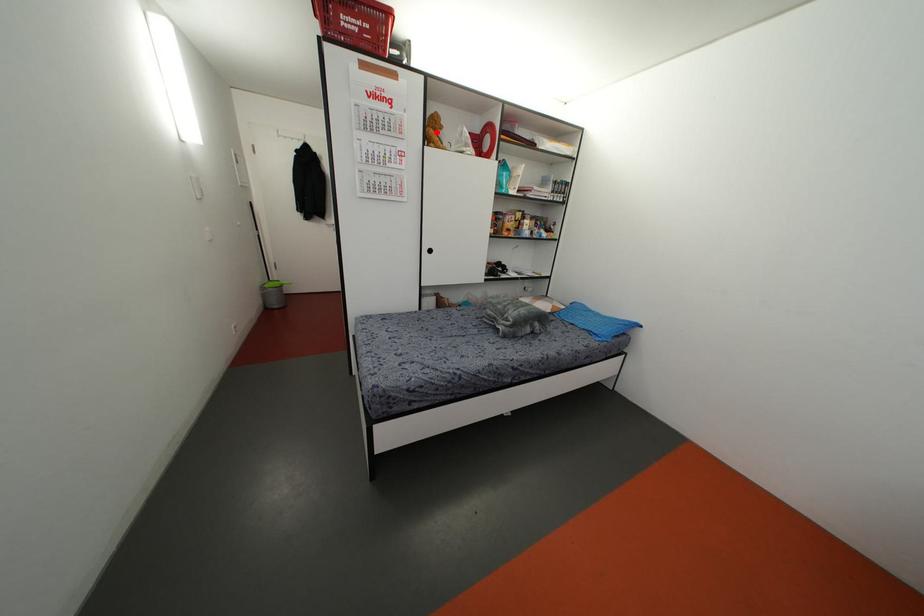
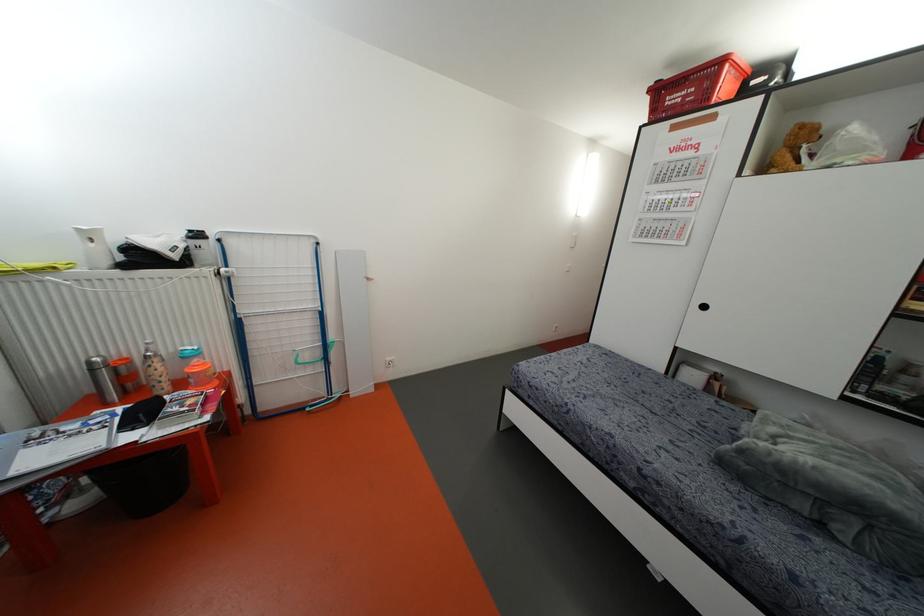
The point at the highlighted location is marked in the first image. Where is the corresponding point in the second image?

(796, 150)